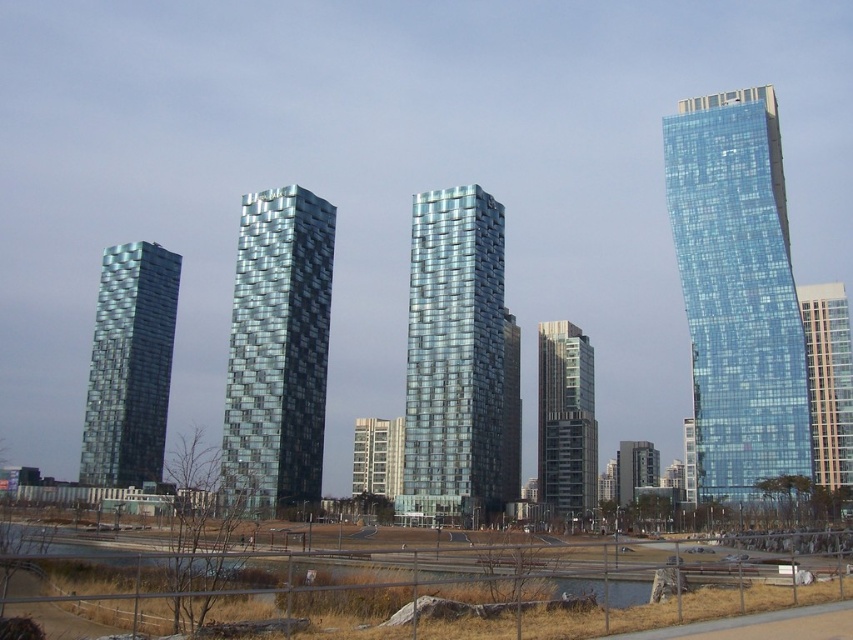
You are standing at the fence in the foreground and want to take a photo of both the transparent glass skyscraper at right and the glassy metallic building at center. Which building should you adjust your camera angle upwards to include in the frame?

You should adjust your camera angle upwards to include the transparent glass skyscraper at right because it is located above the glassy metallic building at center.

You are a city planner assessing the urban layout. You notice the transparent glass skyscraper at right and the glassy metallic building at center. Which of these two buildings takes up more visual space in the image?

The glassy metallic building at center occupies more visual space than the transparent glass skyscraper at right.